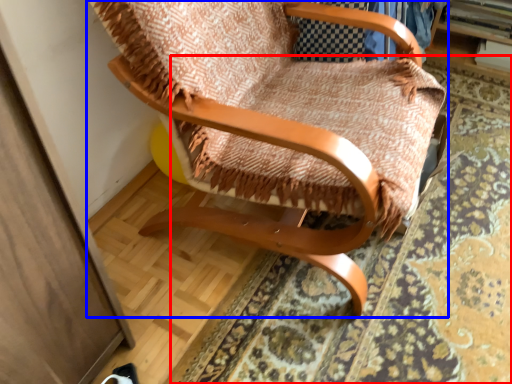
Question: Which of the following is the farthest to the observer, mat (highlighted by a red box) or chair (highlighted by a blue box)?

Choices:
 (A) mat
 (B) chair

Answer: (A)